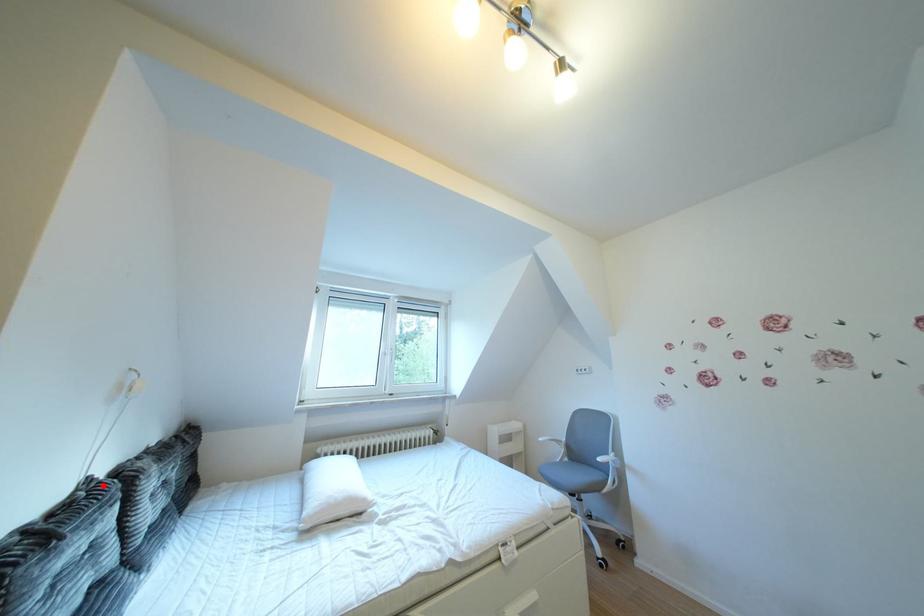
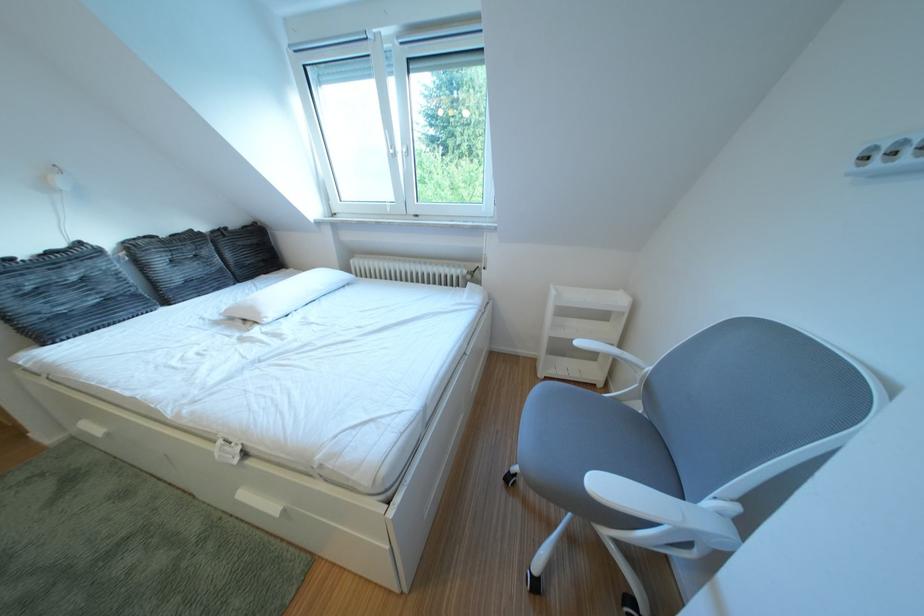
The point at the highlighted location is marked in the first image. Where is the corresponding point in the second image?

(93, 249)